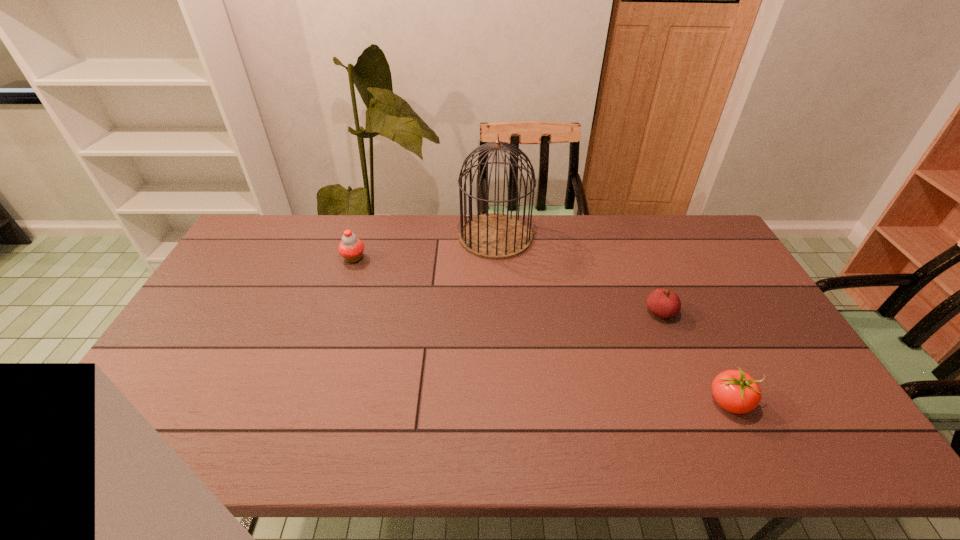
I want to click on the tallest object, so click(x=495, y=236).

Locate an element on the screen. The height and width of the screenshot is (540, 960). birdcage is located at coordinates (495, 236).

I want to click on cupcake, so click(351, 248).

The height and width of the screenshot is (540, 960). What are the coordinates of `the nearer tomato` in the screenshot? It's located at (735, 391).

Identify the location of the third farthest object. Image resolution: width=960 pixels, height=540 pixels. (663, 303).

The image size is (960, 540). Identify the location of vacant space positioned at the door of the third object from right to left. (499, 326).

The image size is (960, 540). In order to click on vacant space located on the left of the cupcake in this screenshot , I will do `click(285, 258)`.

At what (x,y) coordinates should I click in order to perform the action: click on vacant space located on the left of the nearer tomato. Please return your answer as a coordinate pair (x, y). Image resolution: width=960 pixels, height=540 pixels. Looking at the image, I should click on (545, 402).

Identify the location of blank area located on the left of the third farthest object. (524, 313).

In order to click on birdcage that is at the far edge in this screenshot , I will do `click(495, 236)`.